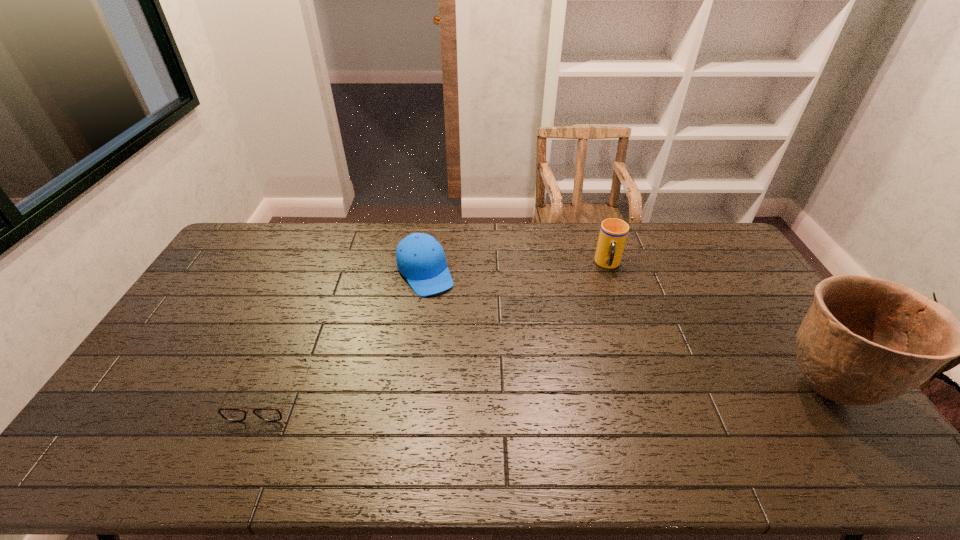
Where is `vacant space on the desktop that is between the shortest object and the tallest object and is positioned on the front-facing side of the second shortest object`? vacant space on the desktop that is between the shortest object and the tallest object and is positioned on the front-facing side of the second shortest object is located at coordinates (498, 390).

Locate an element on the screen. The image size is (960, 540). free spot on the desktop that is between the leftmost object and the rightmost object and is positioned on the side of the cup with the handle is located at coordinates (612, 390).